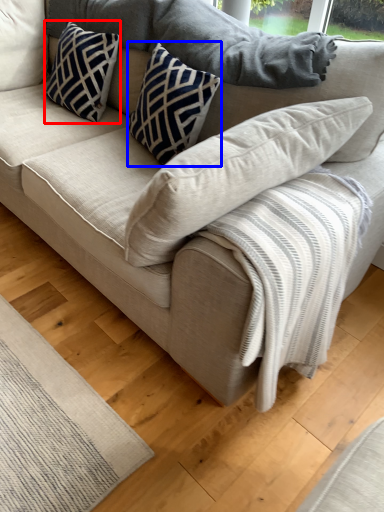
Question: Which point is closer to the camera, pillow (highlighted by a red box) or pillow (highlighted by a blue box)?

Choices:
 (A) pillow
 (B) pillow

Answer: (B)